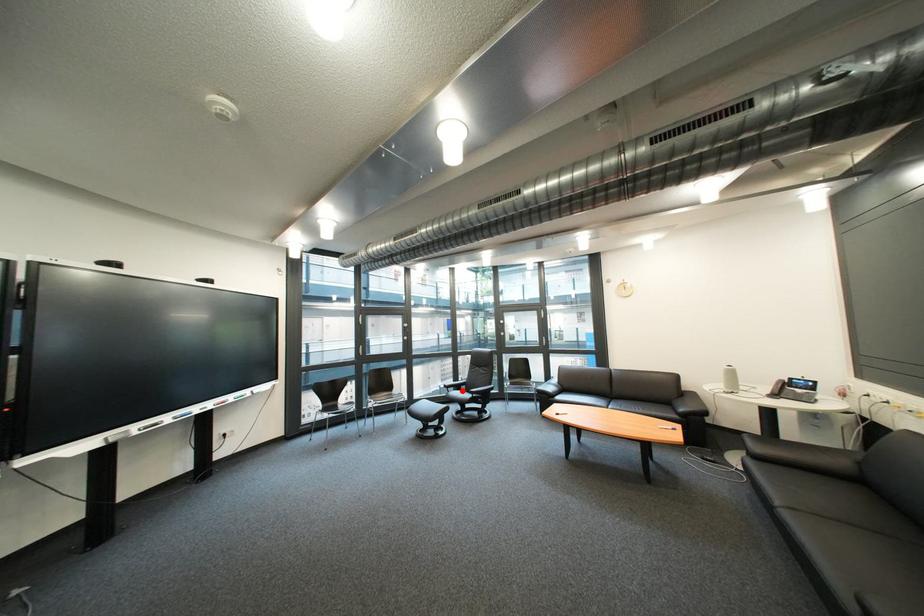
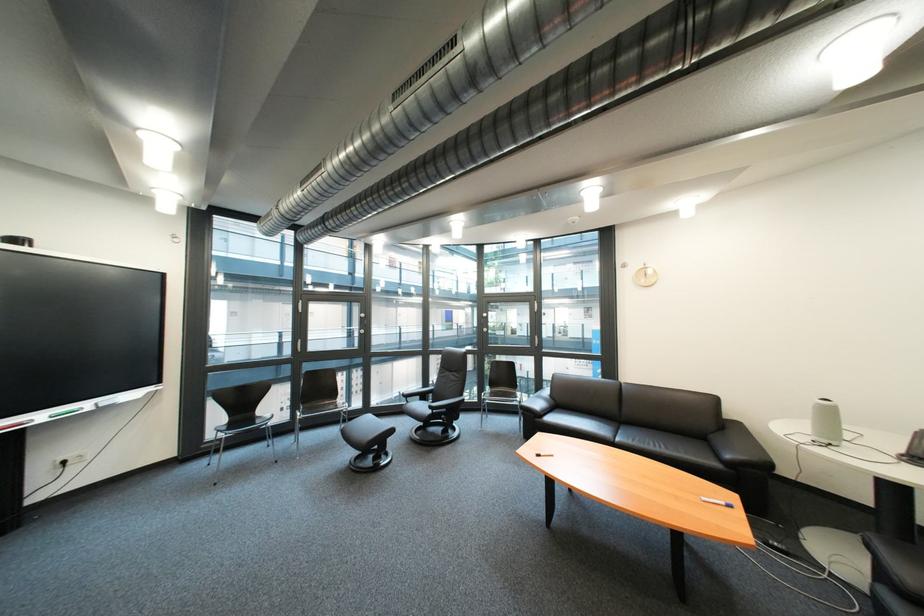
The point at the highlighted location is marked in the first image. Where is the corresponding point in the second image?

(421, 400)